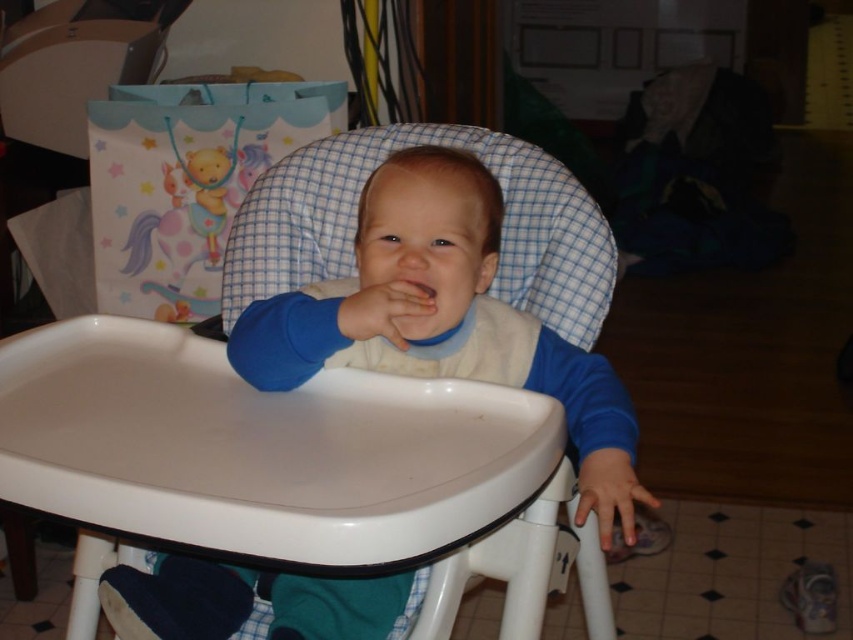
The baby is wearing a blue cotton bib at center and has pink matte flesh at center. Which of these two items is taller?

The blue cotton bib at center is much taller than the pink matte flesh at center.

You are a photographer taking a picture of the baby in the high chair. You notice two points in the scene marked as point 1 at coordinates point (236, 352) and point 2 at coordinates point (421, 282). Which point is closer to the camera?

Point (236, 352) is closer to the viewer than point (421, 282), so the photographer should focus on that point first if it is the main subject.

You are a photographer taking a picture of the baby in the high chair. You notice the blue cotton bib at center and the smooth skin hand at lower right. Which object should you focus on to ensure it appears larger in the photo?

The blue cotton bib at center is taller than the smooth skin hand at lower right, so focusing on the blue cotton bib at center will make it appear larger in the photo.